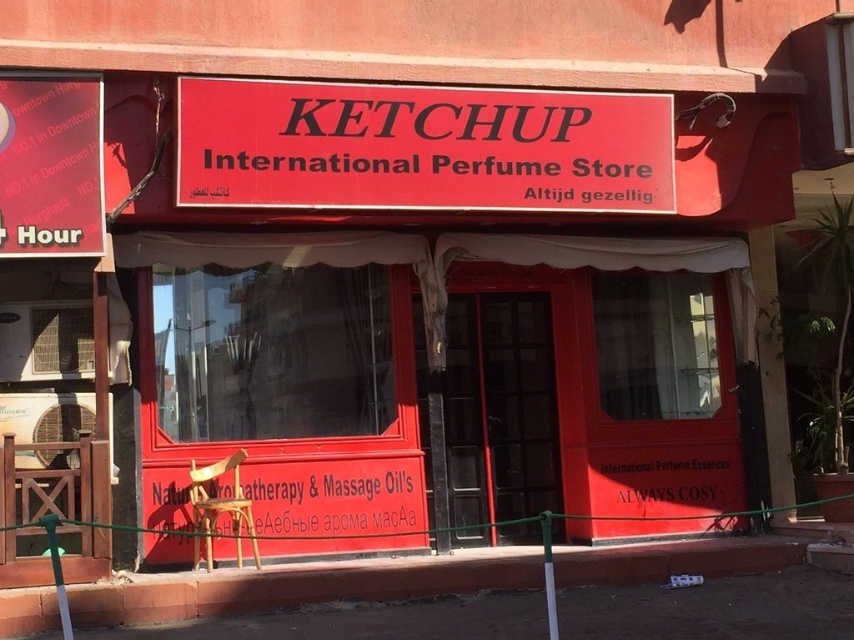
You are standing in front of the perfume store and want to place a new advertisement. The store manager asks you to place it closer to the entrance than to the Dutch slogan. The entrance is near point (x=209, y=93) and the Dutch slogan is near point (x=361, y=483). Where should you place the advertisement?

You should place the advertisement closer to point (x=209, y=93) because it is in front of point (x=361, y=483), so placing it near the entrance ensures it is closer to the entrance than the Dutch slogan.

You are standing at the entrance of the KETCHUP International Perfume Store and need to reach both the red matte sign at center and the white matte signboard at center. Which one is closer to you?

The red matte sign at center is 7.31 feet away from the white matte signboard at center, so the white matte signboard at center is closer to you since it is positioned behind the red sign.